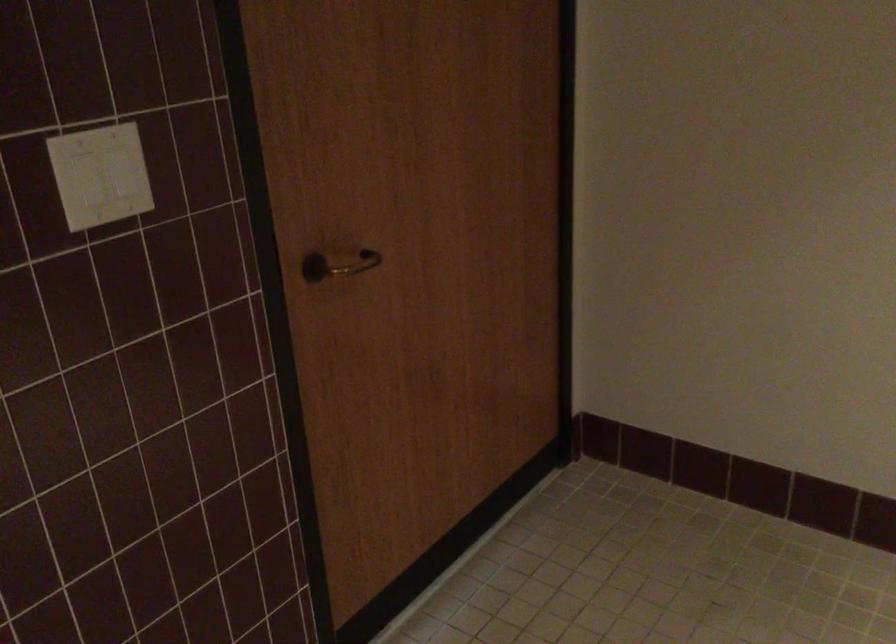
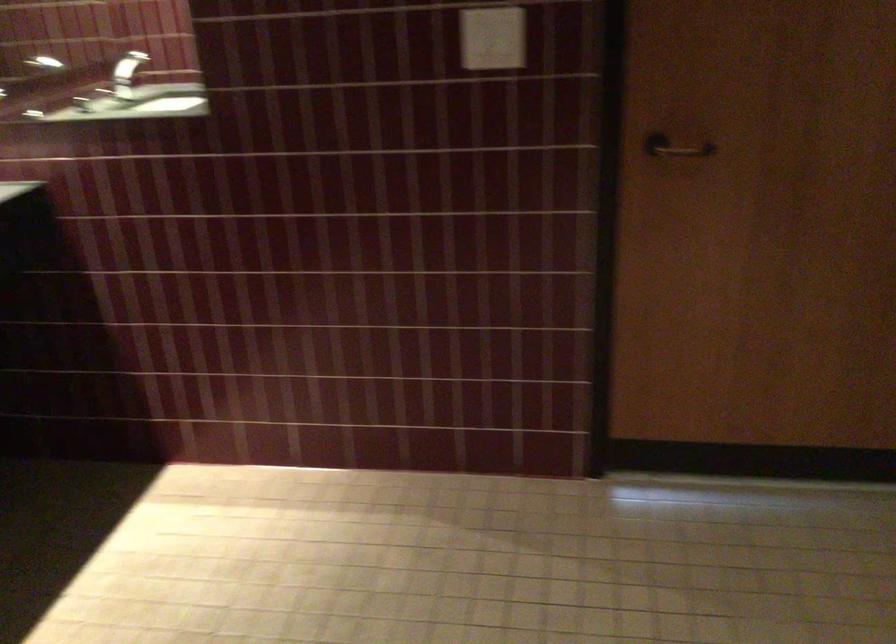
The point at (487, 384) is marked in the first image. Where is the corresponding point in the second image?

(857, 321)